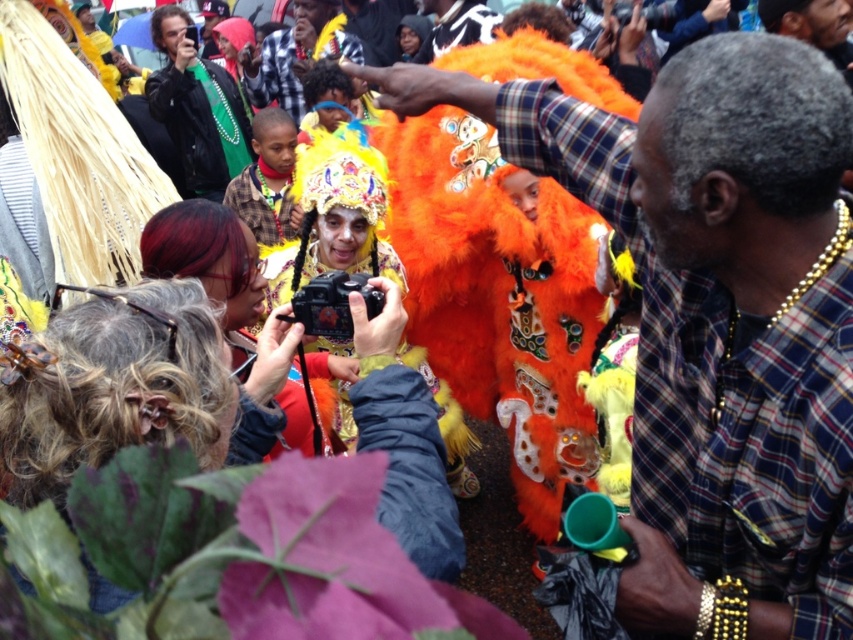
You are a photographer at the event and want to take a photo that includes both the green fabric jacket at upper left and the orange fuzzy costume at center. Which object should be positioned to the left in the frame?

The green fabric jacket at upper left should be positioned to the left of the orange fuzzy costume at center in the frame since it is already located to the left of the orange fuzzy costume at center in the scene.

You are a photographer at the event and want to ensure both the plaid shirt at center and the orange fuzzy costume at center are clearly visible in your photo. Given their sizes, which object should you focus on first to ensure proper framing?

The plaid shirt at center has a smaller size compared to orange fuzzy costume at center, so you should focus on the plaid shirt at center first to ensure its details are captured clearly before adjusting the framing for the larger costume.

You are a photographer at the event and want to take a photo of both the plaid shirt at center and the green fabric jacket at upper left. Can you fit both subjects into your camera frame if your camera has a maximum distance coverage of 15 feet between the nearest and farthest objects?

The plaid shirt at center is 17.36 feet away from the green fabric jacket at upper left. Since the camera can only cover up to 15 feet between the nearest and farthest objects, the distance exceeds the camera capabilities, so both subjects cannot be captured in the same frame.